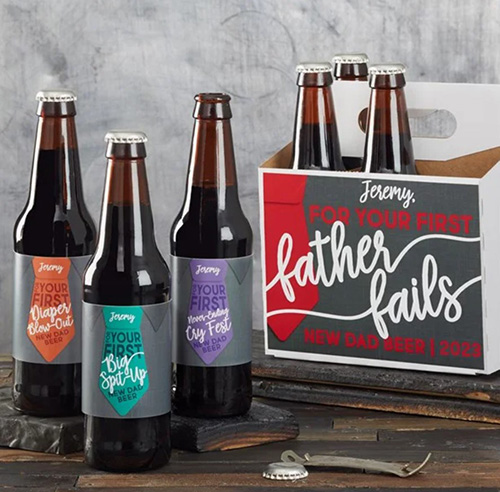
Locate an element on the screen. This screenshot has height=492, width=500. wood table/floor is located at coordinates (222, 478).